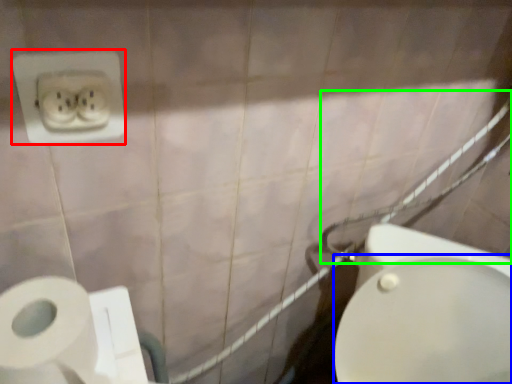
Question: Which object is positioned closest to power plugs and sockets (highlighted by a red box)? Select from bidet (highlighted by a blue box) and shower (highlighted by a green box).

Choices:
 (A) bidet
 (B) shower

Answer: (A)